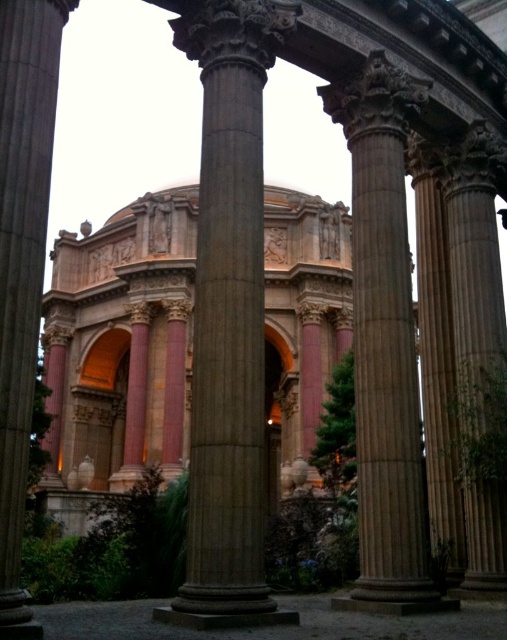
You are standing at the entrance of the Palace of Fine Arts and notice a point marked at coordinates (x=229, y=317). Which object from the scene does this point most likely indicate?

The point at coordinates (x=229, y=317) corresponds to the brown stone column at center.